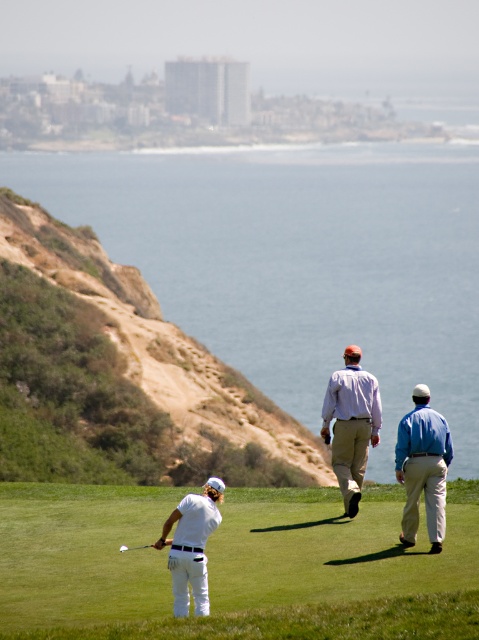
You are standing at point (187, 497) and want to walk to point (436, 228). Based on the golf course layout, will you need to walk towards the camera or away from it?

You need to walk away from the camera to reach point (436, 228) from point (187, 497) because point (436, 228) is behind point (187, 497).

You are standing at the point labeled as point (352, 422) in the image. What color is the shirt of the person you are currently standing on?

The point (352, 422) is on light purple shirt at center, so the shirt color is light purple.